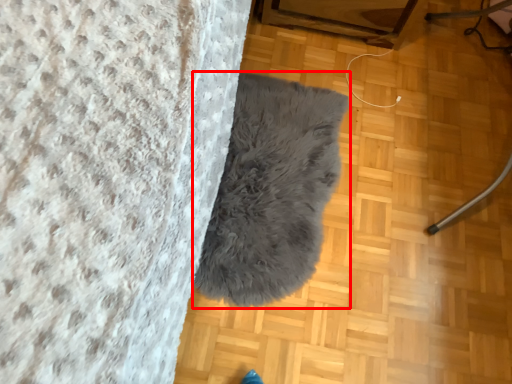
Question: From the image, what is the correct spatial relationship of blanket (annotated by the red box) in relation to furniture?

Choices:
 (A) left
 (B) right

Answer: (A)